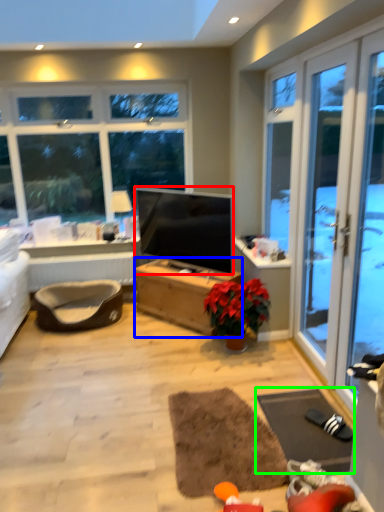
Question: Based on their relative distances, which object is nearer to television (highlighted by a red box)? Choose from desk (highlighted by a blue box) and yoga mat (highlighted by a green box).

Choices:
 (A) desk
 (B) yoga mat

Answer: (A)